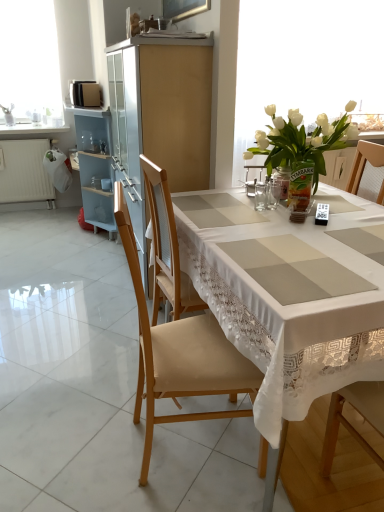
Locate an element on the screen. unoccupied area in front of translucent glass vase at upper right is located at coordinates (327, 216).